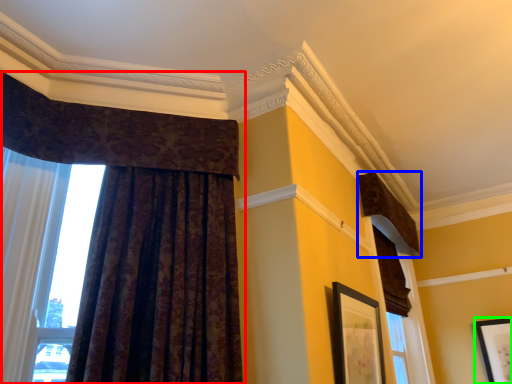
Question: Considering the real-world distances, which object is farthest from curtain (highlighted by a red box)? curtain (highlighted by a blue box) or picture frame (highlighted by a green box)?

Choices:
 (A) curtain
 (B) picture frame

Answer: (B)